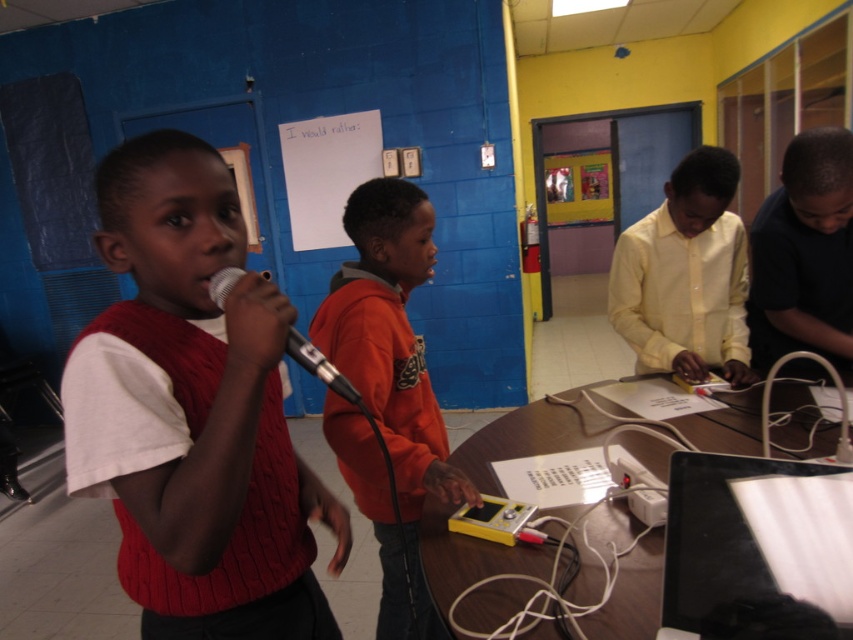
Question: Is orange fleece hoodie at center positioned in front of silver metallic microphone at center?

Choices:
 (A) yes
 (B) no

Answer: (B)

Question: Which point appears farthest from the camera in this image?

Choices:
 (A) (724, 588)
 (B) (223, 280)
 (C) (154, 348)

Answer: (C)

Question: Which point appears closest to the camera in this image?

Choices:
 (A) (229, 570)
 (B) (283, 346)
 (C) (387, 524)
 (D) (807, 257)

Answer: (B)

Question: Considering the real-world distances, which object is closest to the orange fleece hoodie at center?

Choices:
 (A) yellow plastic device at center
 (B) cable-knit sweater at left
 (C) black glossy laptop at lower right
 (D) black matte shirt at right

Answer: (A)

Question: Can you confirm if black matte shirt at right is thinner than yellow plastic device at center?

Choices:
 (A) no
 (B) yes

Answer: (A)

Question: Can you confirm if cable-knit sweater at left is bigger than black glossy laptop at lower right?

Choices:
 (A) no
 (B) yes

Answer: (B)